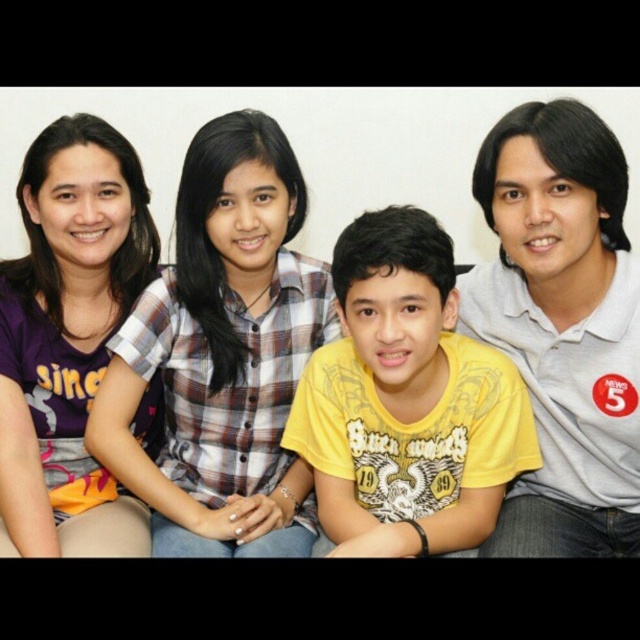
You are standing in front of the group photo of four people. There are two points marked on the image. The first point is at coordinate point (120, 228) and the second point is at coordinate point (372, 106). Which point is closer to you?

Point (120, 228) is in front of point (372, 106), so it is closer to you.

You are a photographer adjusting the lighting for a group photo. You notice the plaid fabric shirt at center and the yellow matte shirt at center. Which shirt should you focus the light on to ensure it stands out more due to its larger size?

The plaid fabric shirt at center has a greater width than the yellow matte shirt at center, so focusing the light on the plaid fabric shirt at center would make it stand out more due to its larger size.